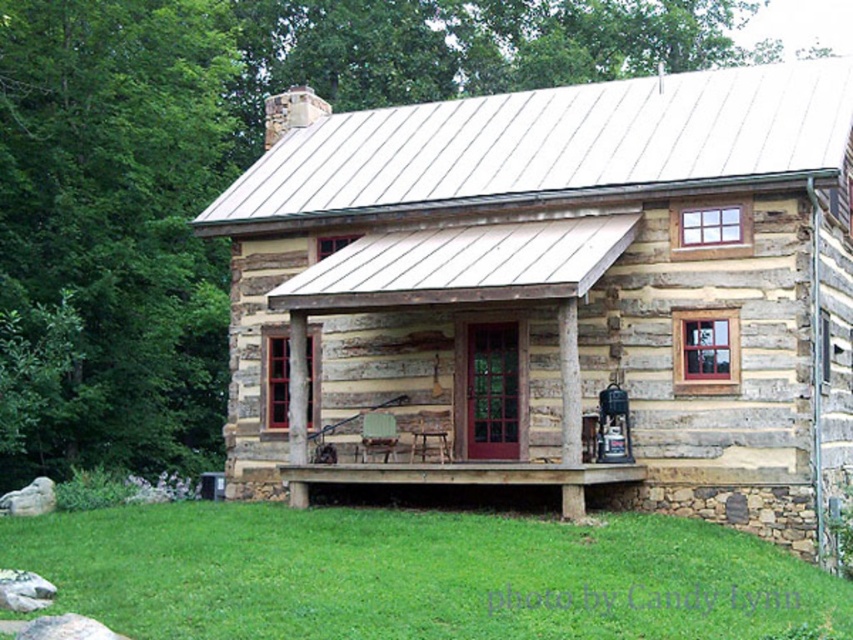
Measure the distance from weathered wood cabin at center to green grass at lower center.

The distance of weathered wood cabin at center from green grass at lower center is 24.72 feet.

Is weathered wood cabin at center bigger than green grass at lower center?

Yes, weathered wood cabin at center is bigger than green grass at lower center.

Where is `weathered wood cabin at center`? The height and width of the screenshot is (640, 853). weathered wood cabin at center is located at coordinates (556, 289).

What do you see at coordinates (416, 576) in the screenshot? I see `green grass at lower center` at bounding box center [416, 576].

From the picture: Who is positioned more to the left, green grass at lower center or brown wooden porch at center?

From the viewer's perspective, green grass at lower center appears more on the left side.

Is point (672, 576) farther from viewer compared to point (587, 477)?

That is False.

Locate an element on the screen. green grass at lower center is located at coordinates (416, 576).

Is weathered wood cabin at center closer to camera compared to brown wooden porch at center?

Yes, it is.

The width and height of the screenshot is (853, 640). Describe the element at coordinates (556, 289) in the screenshot. I see `weathered wood cabin at center` at that location.

Identify the location of weathered wood cabin at center. The image size is (853, 640). (556, 289).